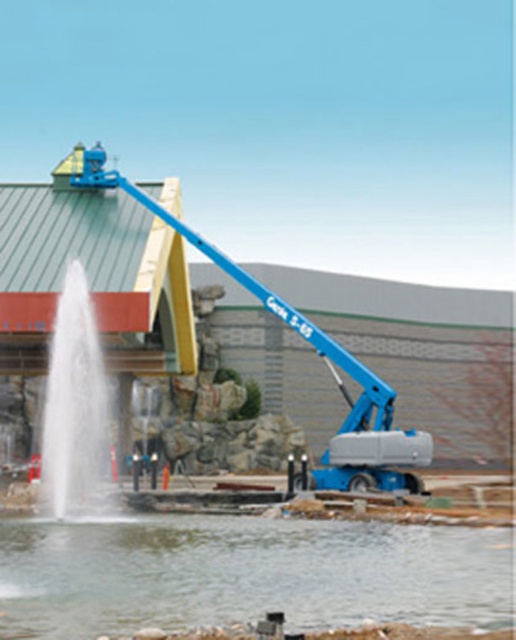
Question: Which object is the farthest from the white frothy water at center?

Choices:
 (A) blue metallic lift at center
 (B) clear water at lower center

Answer: (B)

Question: Does white frothy water at center have a smaller size compared to blue metallic lift at center?

Choices:
 (A) no
 (B) yes

Answer: (B)

Question: Can you confirm if white frothy water at center is bigger than blue metallic lift at center?

Choices:
 (A) yes
 (B) no

Answer: (B)

Question: Which point is farther to the camera?

Choices:
 (A) clear water at lower center
 (B) blue metallic lift at center

Answer: (B)

Question: Which of the following is the closest to the observer?

Choices:
 (A) (312, 620)
 (B) (83, 477)
 (C) (372, 424)

Answer: (A)

Question: Is white frothy water at center below blue metallic lift at center?

Choices:
 (A) yes
 (B) no

Answer: (A)